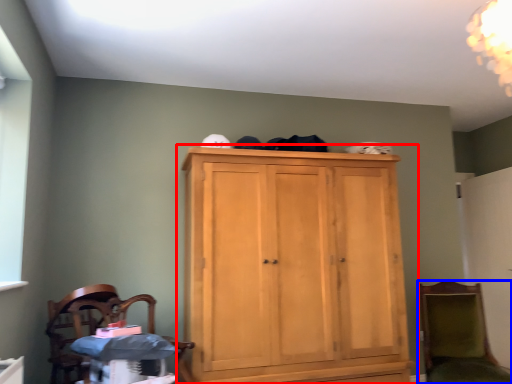
Question: Which object is further to the camera taking this photo, cupboard (highlighted by a red box) or chair (highlighted by a blue box)?

Choices:
 (A) cupboard
 (B) chair

Answer: (B)